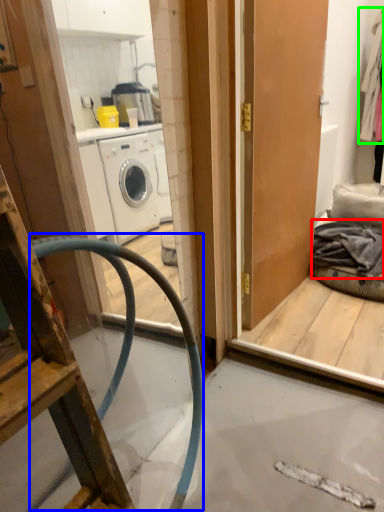
Question: Which is farther away from clothing (highlighted by a red box)? garden hose (highlighted by a blue box) or clothing (highlighted by a green box)?

Choices:
 (A) garden hose
 (B) clothing

Answer: (B)